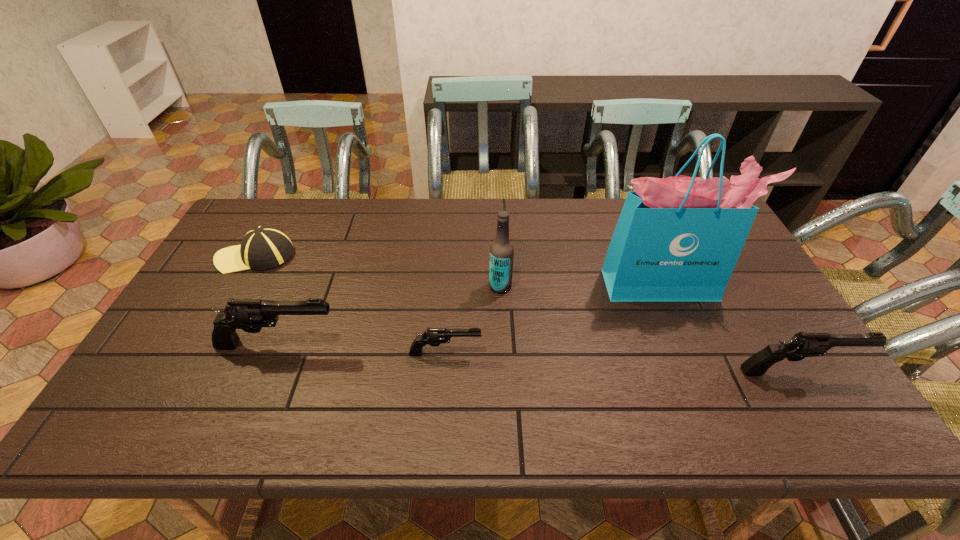
Locate an element on the screen. The height and width of the screenshot is (540, 960). shopping bag positioned at the right edge is located at coordinates (678, 239).

This screenshot has height=540, width=960. What are the coordinates of `object at the far left corner` in the screenshot? It's located at (264, 247).

Where is `object present at the near right corner`? Image resolution: width=960 pixels, height=540 pixels. object present at the near right corner is located at coordinates tap(801, 345).

Locate an element on the screen. The image size is (960, 540). vacant space at the far edge is located at coordinates (337, 207).

The height and width of the screenshot is (540, 960). What are the coordinates of `vacant space at the near edge of the desktop` in the screenshot? It's located at (714, 389).

This screenshot has height=540, width=960. Identify the location of vacant space at the right edge of the desktop. (762, 302).

At what (x,y) coordinates should I click in order to perform the action: click on free spot between the shopping bag and the baseball cap. Please return your answer as a coordinate pair (x, y). The width and height of the screenshot is (960, 540). Looking at the image, I should click on click(459, 271).

At what (x,y) coordinates should I click in order to perform the action: click on free space between the second gun from right to left and the rightmost gun. Please return your answer as a coordinate pair (x, y). This screenshot has width=960, height=540. Looking at the image, I should click on (621, 362).

This screenshot has height=540, width=960. I want to click on empty space that is in between the leftmost gun and the shortest gun, so 362,348.

The image size is (960, 540). What are the coordinates of `empty location between the nearest object and the beer bottle` in the screenshot? It's located at (649, 328).